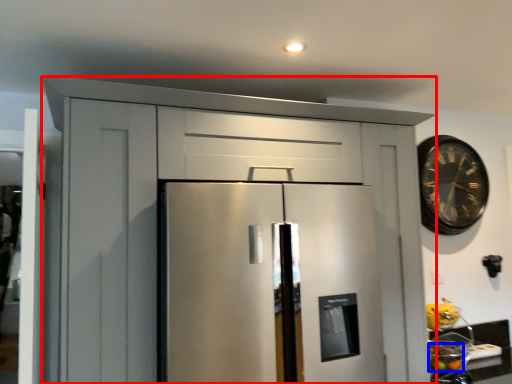
Question: Which object appears farthest to the camera in this image, cabinetry (highlighted by a red box) or fruit (highlighted by a blue box)?

Choices:
 (A) cabinetry
 (B) fruit

Answer: (B)